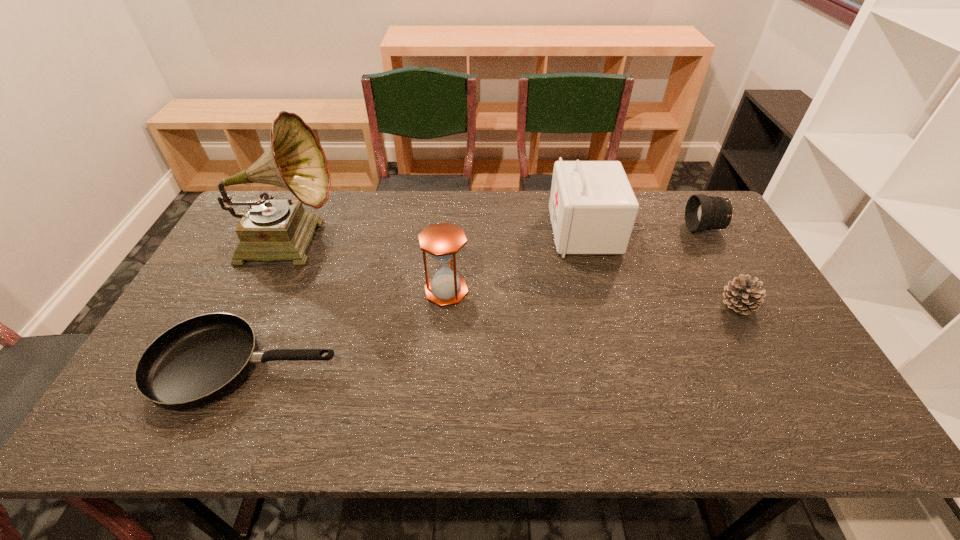
Image resolution: width=960 pixels, height=540 pixels. In order to click on the first-aid kit that is at the far edge in this screenshot , I will do `click(592, 206)`.

You are a GUI agent. You are given a task and a screenshot of the screen. Output one action in this format:
    pyautogui.click(x=<x>, y=<y>)
    Task: Click on the telephoto lens at the far edge
    The height and width of the screenshot is (540, 960).
    Given the screenshot: What is the action you would take?
    pyautogui.click(x=702, y=212)

Locate an element on the screen. This screenshot has width=960, height=540. object located in the near edge section of the desktop is located at coordinates (198, 361).

At what (x,y) coordinates should I click in order to perform the action: click on record player that is at the left edge. Please return your answer as a coordinate pair (x, y). This screenshot has width=960, height=540. Looking at the image, I should click on coord(269,230).

Identify the location of frying pan that is positioned at the left edge. The image size is (960, 540). (198, 361).

Where is `telephoto lens at the right edge`? The height and width of the screenshot is (540, 960). telephoto lens at the right edge is located at coordinates (702, 212).

The width and height of the screenshot is (960, 540). I want to click on pinecone present at the right edge, so tap(743, 295).

Where is `object located in the far left corner section of the desktop`? object located in the far left corner section of the desktop is located at coordinates (269, 230).

The width and height of the screenshot is (960, 540). What are the coordinates of `object present at the near left corner` in the screenshot? It's located at (198, 361).

The width and height of the screenshot is (960, 540). What are the coordinates of `object situated at the far right corner` in the screenshot? It's located at (702, 212).